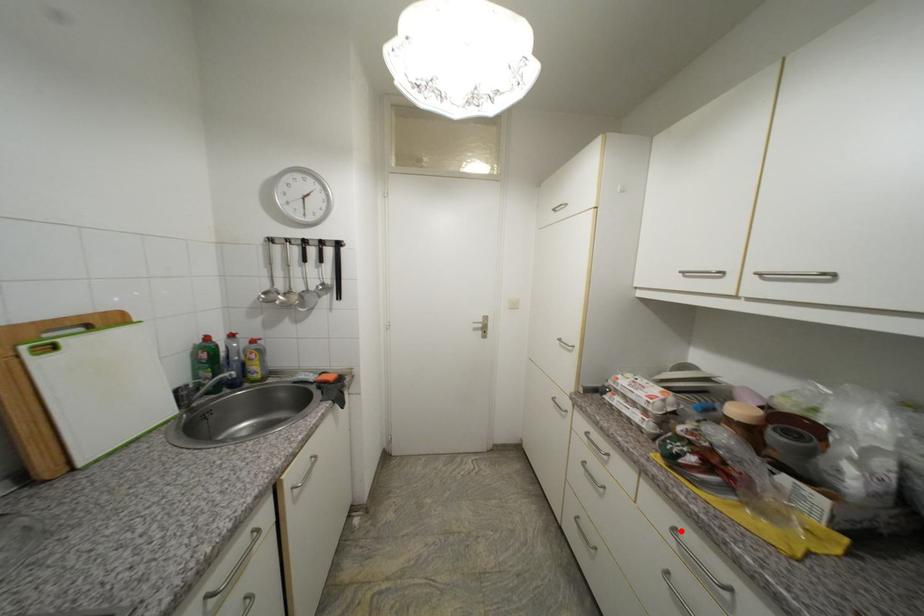
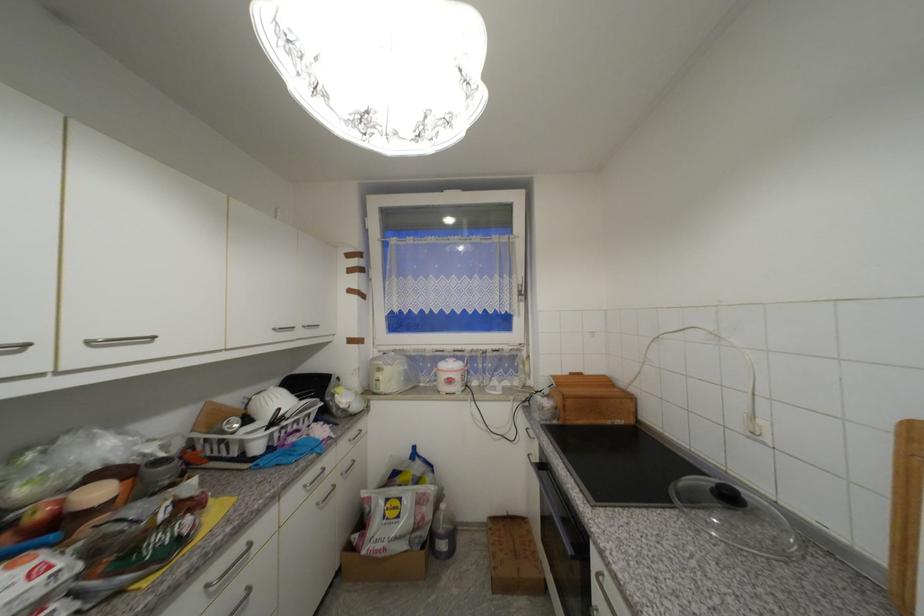
In the second image, find the point that corresponds to the highlighted location in the first image.

(213, 588)